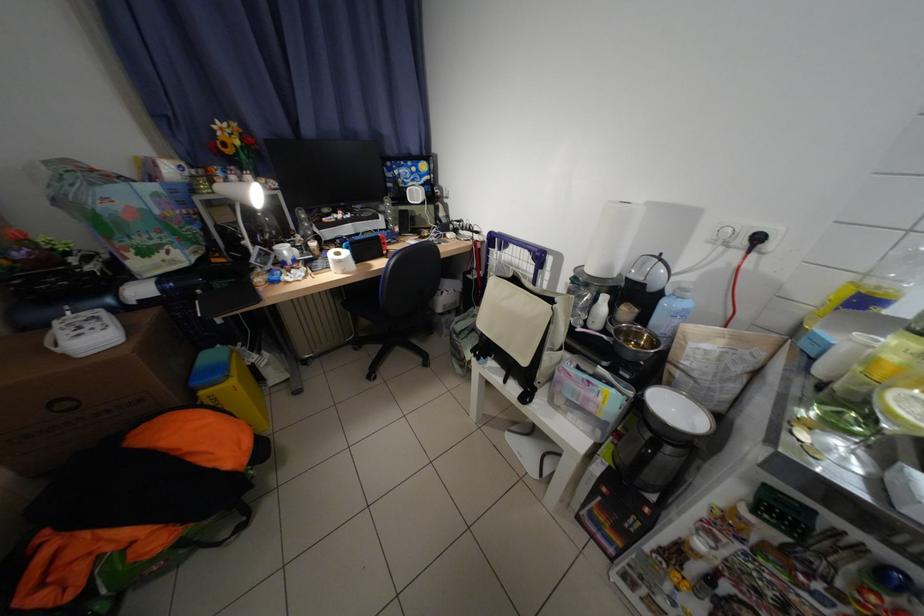
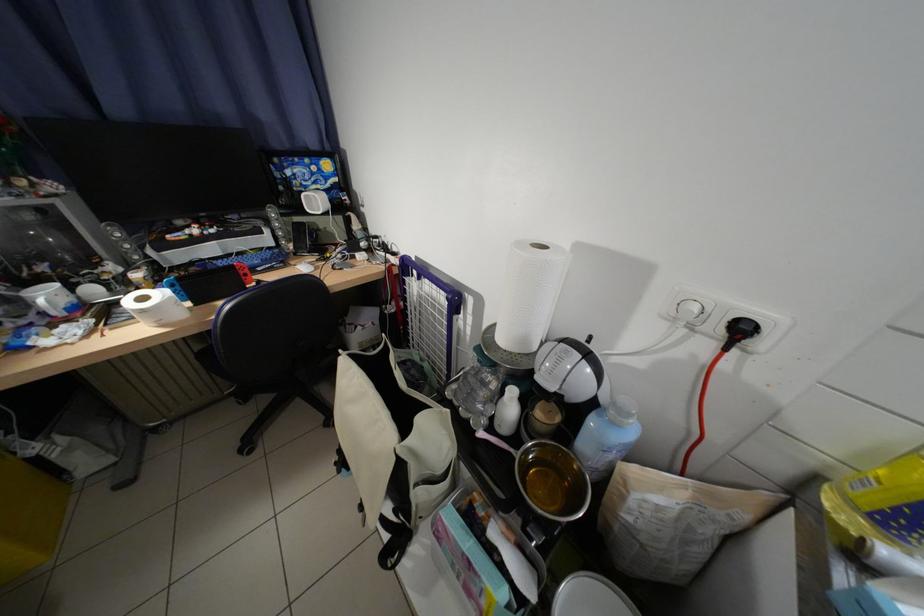
Where in the second image is the point corresponding to point 602,272 from the first image?

(514, 341)